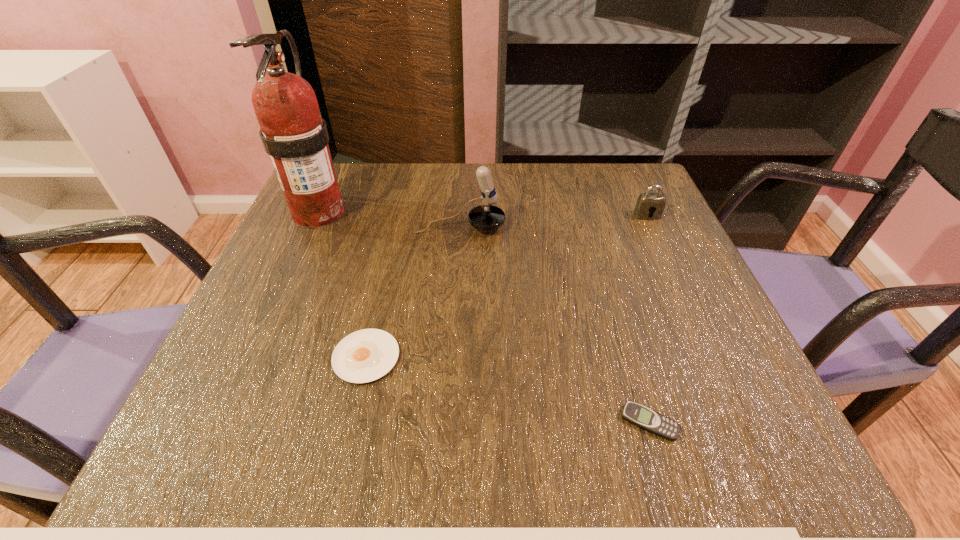
What are the coordinates of `the leftmost object` in the screenshot? It's located at (293, 133).

Identify the location of the tallest object. (293, 133).

At what (x,y) coordinates should I click in order to perform the action: click on the fourth shortest object. Please return your answer as a coordinate pair (x, y). This screenshot has width=960, height=540. Looking at the image, I should click on (486, 217).

Identify the location of the third shortest object. The image size is (960, 540). (647, 203).

The width and height of the screenshot is (960, 540). What are the coordinates of `the rightmost object` in the screenshot? It's located at (647, 203).

Locate an element on the screen. egg yolk is located at coordinates (366, 355).

Image resolution: width=960 pixels, height=540 pixels. What are the coordinates of `the second object from right to left` in the screenshot? It's located at (645, 418).

This screenshot has height=540, width=960. What are the coordinates of `beeper` in the screenshot? It's located at (645, 418).

Find the location of a particular element. Image resolution: width=960 pixels, height=540 pixels. free space located 0.340m at the nozzle of the fire extinguisher is located at coordinates (243, 384).

Where is `free space located 0.190m on the front of the second tallest object`? free space located 0.190m on the front of the second tallest object is located at coordinates (456, 303).